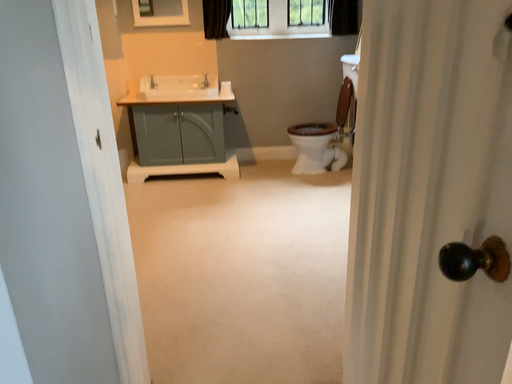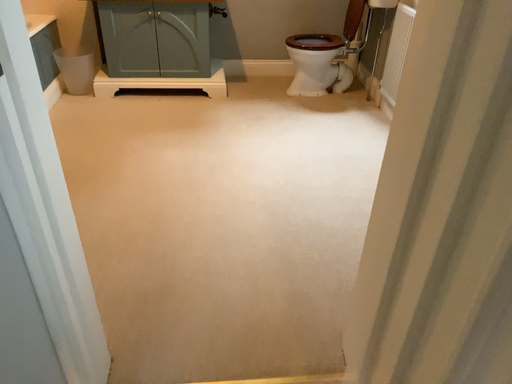
Question: How did the camera likely rotate when shooting the video?

Choices:
 (A) rotated upward
 (B) rotated downward

Answer: (B)